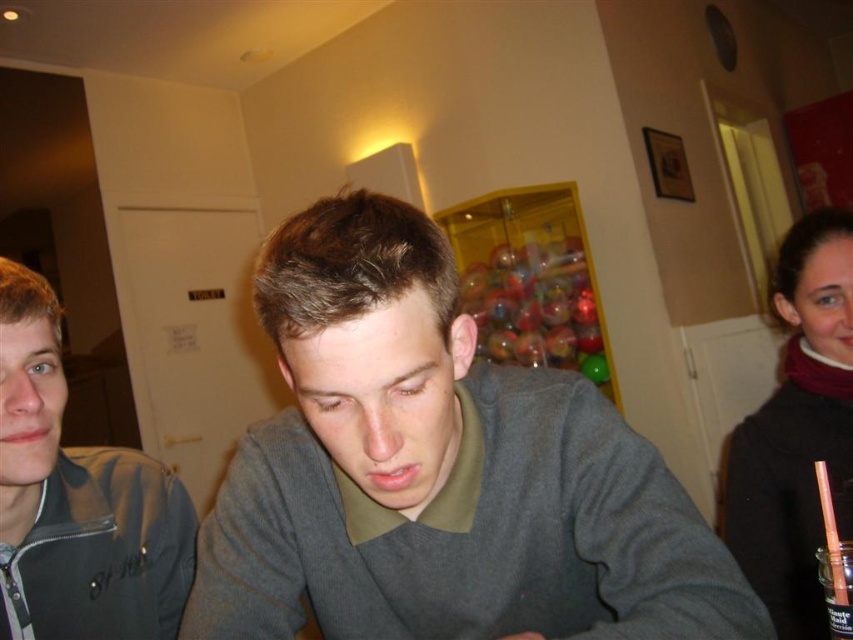
Question: Which is farther from the velvet maroon scarf at right?

Choices:
 (A) gray zip-up jacket at left
 (B) gray matte sweater at center

Answer: (A)

Question: In this image, where is gray matte sweater at center located relative to gray zip-up jacket at left?

Choices:
 (A) left
 (B) right

Answer: (B)

Question: Which of these objects is positioned closest to the gray matte sweater at center?

Choices:
 (A) velvet maroon scarf at right
 (B) gray zip-up jacket at left

Answer: (B)

Question: Which point is farther to the camera?

Choices:
 (A) gray zip-up jacket at left
 (B) velvet maroon scarf at right

Answer: (B)

Question: Does gray matte sweater at center appear under velvet maroon scarf at right?

Choices:
 (A) no
 (B) yes

Answer: (A)

Question: Can you confirm if gray matte sweater at center is bigger than velvet maroon scarf at right?

Choices:
 (A) no
 (B) yes

Answer: (A)